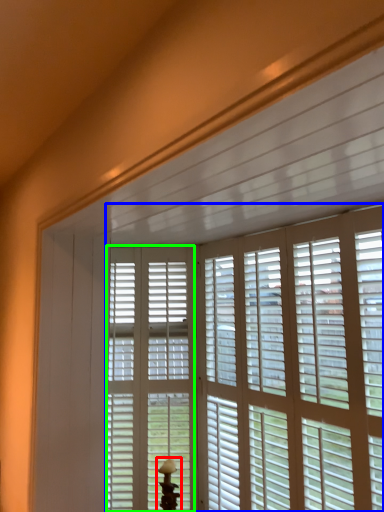
Question: Estimate the real-world distances between objects in this image. Which object is farther from table lamp (highlighted by a red box), window blind (highlighted by a blue box) or screen door (highlighted by a green box)?

Choices:
 (A) window blind
 (B) screen door

Answer: (A)